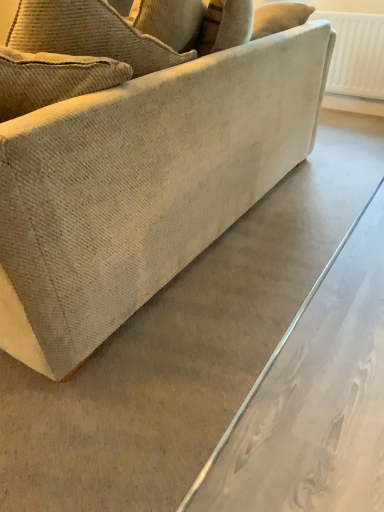
Question: Looking at the image, does beige fabric couch at center seem bigger or smaller compared to white textured radiator at upper right?

Choices:
 (A) small
 (B) big

Answer: (B)

Question: Looking at their shapes, would you say beige fabric couch at center is wider or thinner than white textured radiator at upper right?

Choices:
 (A) wide
 (B) thin

Answer: (A)

Question: Considering the positions of point (51, 169) and point (357, 71), is point (51, 169) closer or farther from the camera than point (357, 71)?

Choices:
 (A) farther
 (B) closer

Answer: (B)

Question: From the image's perspective, is white textured radiator at upper right positioned above or below beige fabric couch at center?

Choices:
 (A) below
 (B) above

Answer: (B)

Question: Is white textured radiator at upper right to the left or to the right of beige fabric couch at center in the image?

Choices:
 (A) left
 (B) right

Answer: (B)

Question: Considering the positions of white textured radiator at upper right and beige fabric couch at center in the image, is white textured radiator at upper right wider or thinner than beige fabric couch at center?

Choices:
 (A) thin
 (B) wide

Answer: (A)

Question: Is white textured radiator at upper right in front of or behind beige fabric couch at center in the image?

Choices:
 (A) front
 (B) behind

Answer: (B)